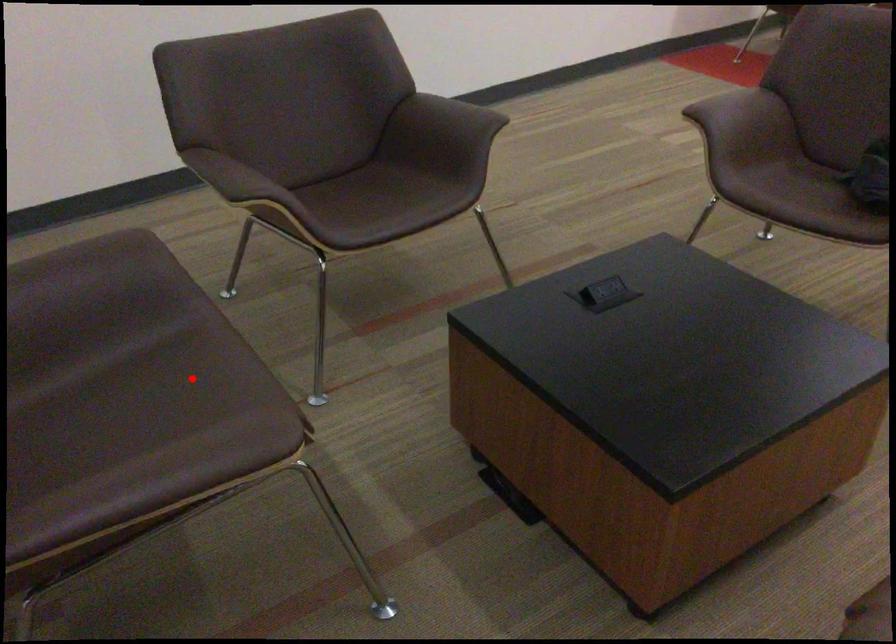
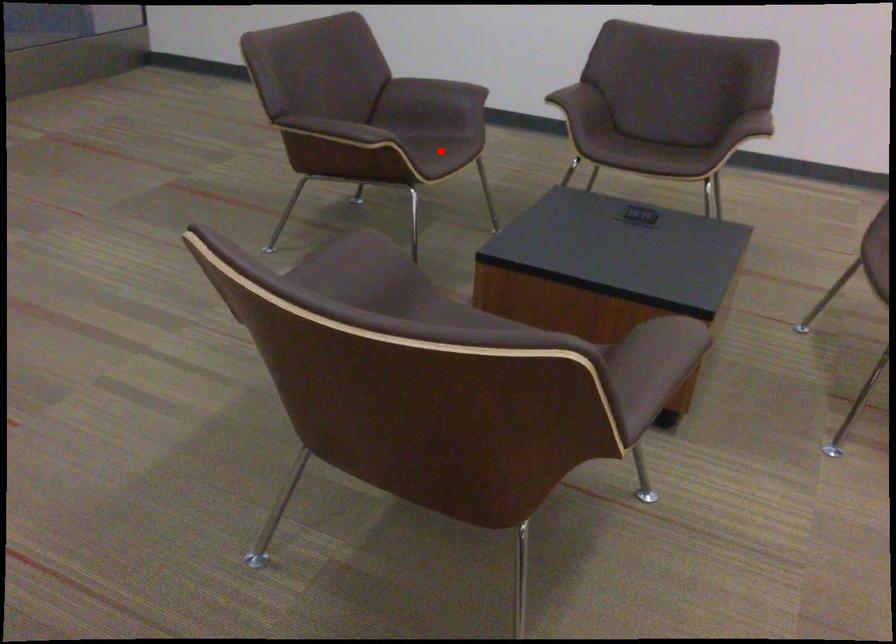
Based on the photo, I am providing you with two images of the same scene from different viewpoints. A red point is marked on the first image and another point is marked on the second image. Is the marked point in image1 the same physical position as the marked point in image2?

Yes